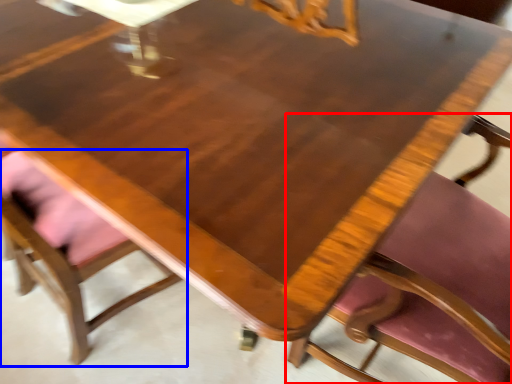
Question: Which of the following is the closest to the observer, chair (highlighted by a red box) or chair (highlighted by a blue box)?

Choices:
 (A) chair
 (B) chair

Answer: (A)